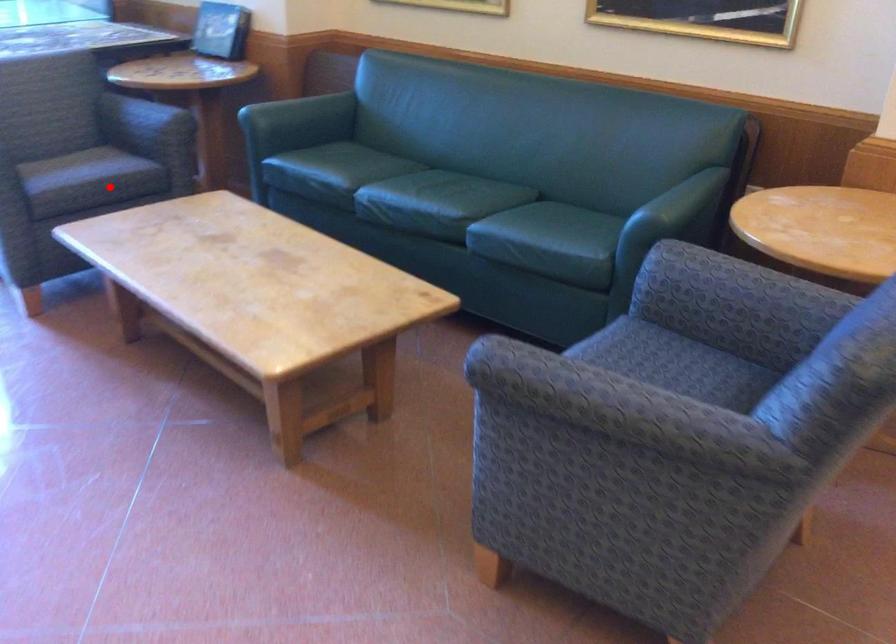
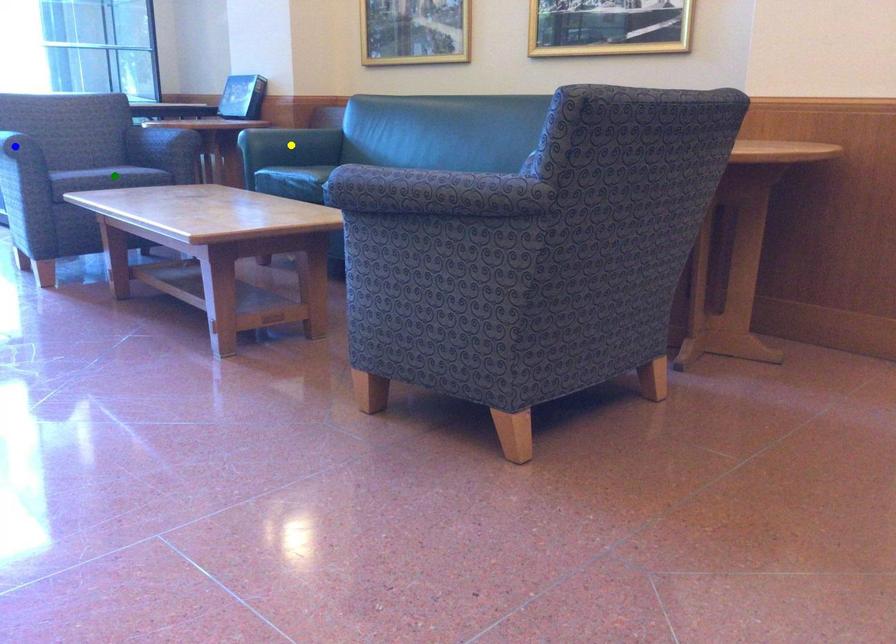
Question: I am providing you with two images of the same scene from different viewpoints. A red point is marked on the first image. You are given multiple points on the second image. Which spot in image 2 lines up with the point in image 1?

Choices:
 (A) yellow point
 (B) blue point
 (C) green point

Answer: (C)